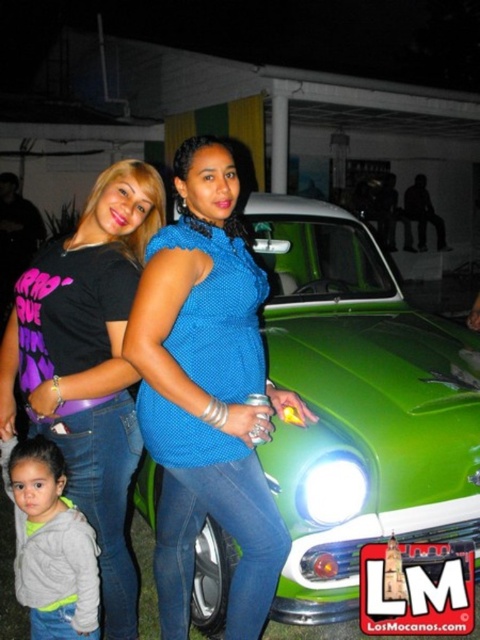
Can you confirm if black matte t-shirt at left is positioned to the right of gray fleece jacket at lower left?

Yes, black matte t-shirt at left is to the right of gray fleece jacket at lower left.

Is point (115, 228) in front of point (24, 461)?

No.

Which is in front, point (110, 340) or point (75, 630)?

Point (110, 340)

Locate an element on the screen. Image resolution: width=480 pixels, height=640 pixels. black matte t-shirt at left is located at coordinates (88, 364).

Between green glossy car at center and gray fleece jacket at lower left, which one appears on the left side from the viewer's perspective?

gray fleece jacket at lower left

Can you confirm if green glossy car at center is thinner than gray fleece jacket at lower left?

No.

Is point (285, 324) more distant than point (52, 522)?

Yes.

I want to click on green glossy car at center, so click(359, 404).

Can you confirm if blue knitted sweater at center is bigger than gray fleece jacket at lower left?

Yes.

How much distance is there between blue knitted sweater at center and gray fleece jacket at lower left?

20.89 inches

This screenshot has width=480, height=640. Find the location of `blue knitted sweater at center`. blue knitted sweater at center is located at coordinates (206, 394).